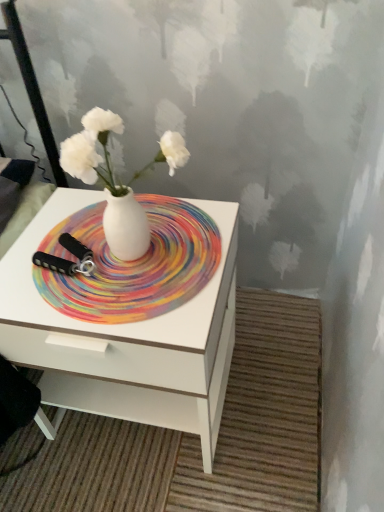
What do you see at coordinates (133, 264) in the screenshot? The image size is (384, 512). I see `rainbow swirl placemat at center` at bounding box center [133, 264].

Consider the image. Measure the distance between point (190, 343) and camera.

27.40 inches.

Describe the element at coordinates (114, 181) in the screenshot. I see `white glossy vase at center` at that location.

The width and height of the screenshot is (384, 512). I want to click on rainbow swirl placemat at center, so click(x=133, y=264).

Consider the image. Are white glossy nightstand at center and rainbow swirl placemat at center located far from each other?

They are positioned close to each other.

In terms of size, does white glossy nightstand at center appear bigger or smaller than rainbow swirl placemat at center?

white glossy nightstand at center is bigger than rainbow swirl placemat at center.

Is rainbow swirl placemat at center inside white glossy nightstand at center?

Yes, rainbow swirl placemat at center is surrounded by white glossy nightstand at center.

Is white glossy nightstand at center shorter than rainbow swirl placemat at center?

No.

You are a GUI agent. You are given a task and a screenshot of the screen. Output one action in this format:
    pyautogui.click(x=<x>, y=<y>)
    Task: Click on the floral arrangement in front of the rainbow swirl placemat at center
    Image resolution: width=384 pixels, height=512 pixels.
    Given the screenshot: What is the action you would take?
    pyautogui.click(x=114, y=181)

Which point is more forward, (104, 257) or (72, 165)?

Positioned in front is point (72, 165).

Is rainbow swirl placemat at center smaller than white glossy vase at center?

Yes, rainbow swirl placemat at center is smaller than white glossy vase at center.

Considering the relative sizes of rainbow swirl placemat at center and white glossy nightstand at center in the image provided, is rainbow swirl placemat at center shorter than white glossy nightstand at center?

Indeed, rainbow swirl placemat at center has a lesser height compared to white glossy nightstand at center.

From the picture: From the image's perspective, is rainbow swirl placemat at center beneath white glossy nightstand at center?

Incorrect, from the image's perspective, rainbow swirl placemat at center is higher than white glossy nightstand at center.

Is rainbow swirl placemat at center in front of white glossy nightstand at center?

No.

Can you see rainbow swirl placemat at center touching white glossy nightstand at center?

No, rainbow swirl placemat at center is not next to white glossy nightstand at center.

Considering the relative positions of white glossy vase at center and rainbow swirl placemat at center in the image provided, is white glossy vase at center to the left of rainbow swirl placemat at center from the viewer's perspective?

No, white glossy vase at center is not to the left of rainbow swirl placemat at center.

Does white glossy vase at center have a lesser height compared to rainbow swirl placemat at center?

No.

Is white glossy vase at center behind rainbow swirl placemat at center?

No, it is not.

In the scene shown: Considering the sizes of objects white glossy vase at center and white glossy nightstand at center in the image provided, who is bigger, white glossy vase at center or white glossy nightstand at center?

white glossy nightstand at center.

From the image's perspective, does white glossy vase at center appear lower than white glossy nightstand at center?

No, from the image's perspective, white glossy vase at center is not below white glossy nightstand at center.

Is white glossy nightstand at center surrounded by white glossy vase at center?

No, white glossy nightstand at center is located outside of white glossy vase at center.

From the image's perspective, between white glossy nightstand at center and white glossy vase at center, who is located below?

white glossy nightstand at center appears lower in the image.

In the image, there is a white glossy vase at center. Where is `nightstand below it (from a real-world perspective)`? The height and width of the screenshot is (512, 384). nightstand below it (from a real-world perspective) is located at coordinates (125, 340).

Considering the sizes of objects white glossy nightstand at center and white glossy vase at center in the image provided, who is smaller, white glossy nightstand at center or white glossy vase at center?

With smaller size is white glossy vase at center.

Measure the distance between white glossy nightstand at center and white glossy vase at center.

10.51 inches.

The width and height of the screenshot is (384, 512). In order to click on plate on the right of white glossy nightstand at center in this screenshot , I will do `click(133, 264)`.

What are the coordinates of `floral arrangement above the rainbow swirl placemat at center (from the image's perspective)` in the screenshot? It's located at (114, 181).

Estimate the real-world distances between objects in this image. Which object is closer to white glossy nightstand at center, white glossy vase at center or rainbow swirl placemat at center?

The object closer to white glossy nightstand at center is rainbow swirl placemat at center.

From the image, which object appears to be nearer to rainbow swirl placemat at center, white glossy vase at center or white glossy nightstand at center?

Based on the image, white glossy vase at center appears to be nearer to rainbow swirl placemat at center.

From the image, which object appears to be farther from rainbow swirl placemat at center, white glossy nightstand at center or white glossy vase at center?

Among the two, white glossy nightstand at center is located further to rainbow swirl placemat at center.

Estimate the real-world distances between objects in this image. Which object is further from white glossy vase at center, white glossy nightstand at center or rainbow swirl placemat at center?

white glossy nightstand at center.

Consider the image. Considering their positions, is rainbow swirl placemat at center positioned further to white glossy nightstand at center than white glossy vase at center?

white glossy vase at center.

From the image, which object appears to be farther from white glossy vase at center, rainbow swirl placemat at center or white glossy nightstand at center?

white glossy nightstand at center lies further to white glossy vase at center than the other object.

At what (x,y) coordinates should I click in order to perform the action: click on plate between white glossy vase at center and white glossy nightstand at center in the up-down direction. Please return your answer as a coordinate pair (x, y). This screenshot has height=512, width=384. Looking at the image, I should click on (133, 264).